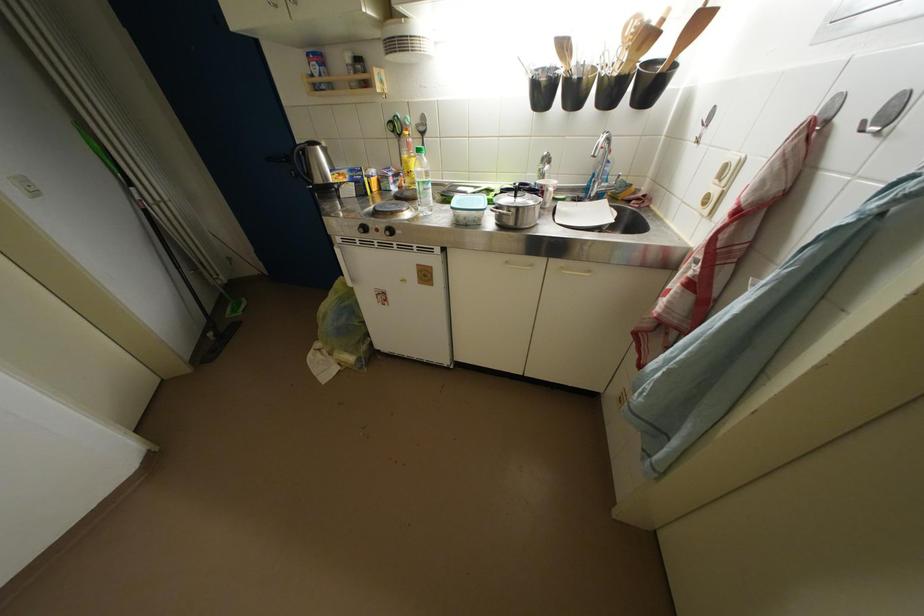
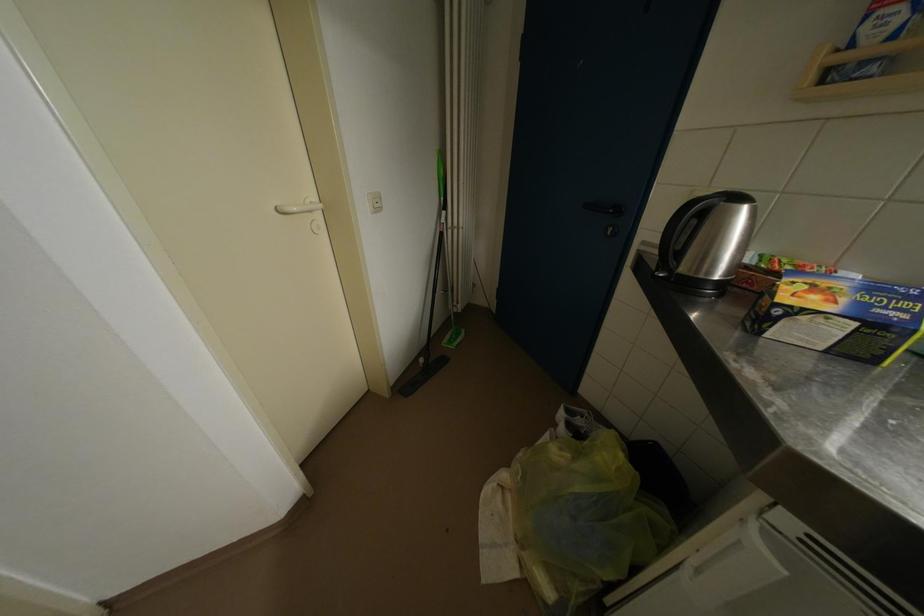
In the second image, find the point that corresponds to (324,152) in the first image.

(752, 213)